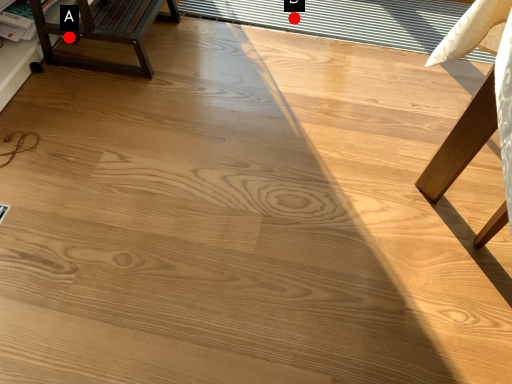
Question: Two points are circled on the image, labeled by A and B beside each circle. Which point is farther to the camera?

Choices:
 (A) A is further
 (B) B is further

Answer: (B)